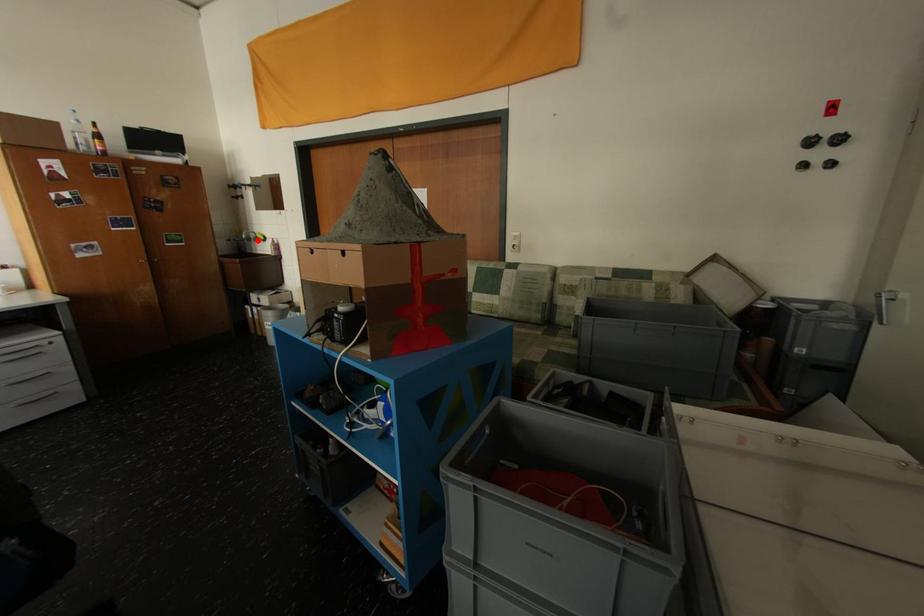
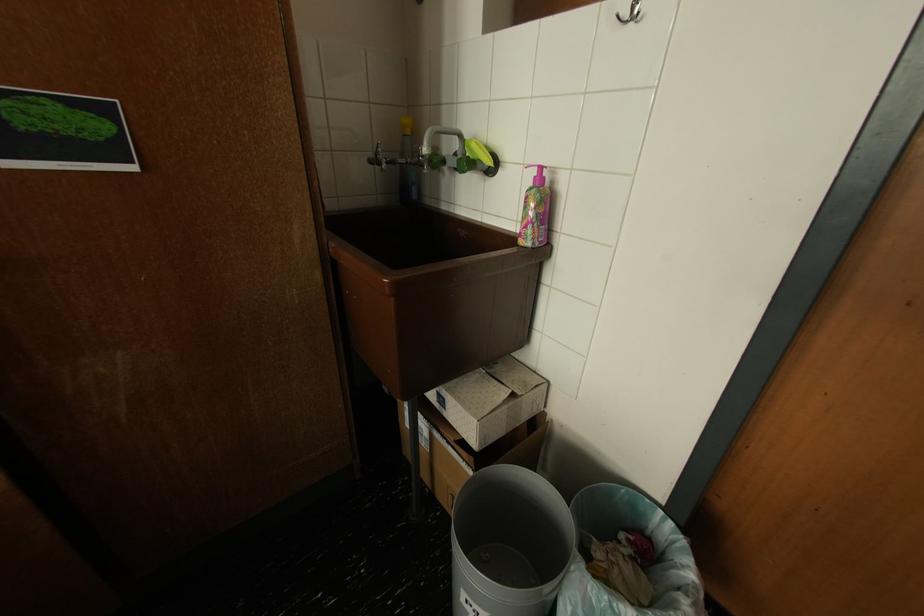
In the second image, find the point that corresponds to the highlighted location in the first image.

(445, 163)